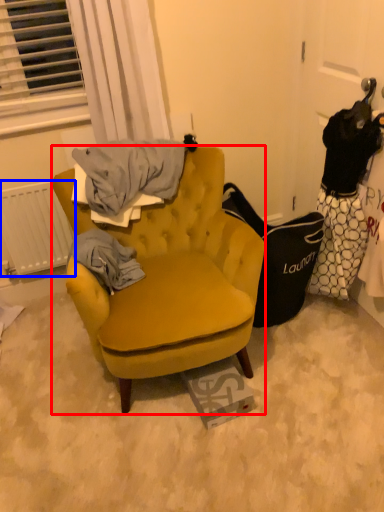
Question: Among these objects, which one is nearest to the camera, chair (highlighted by a red box) or radiator (highlighted by a blue box)?

Choices:
 (A) chair
 (B) radiator

Answer: (A)